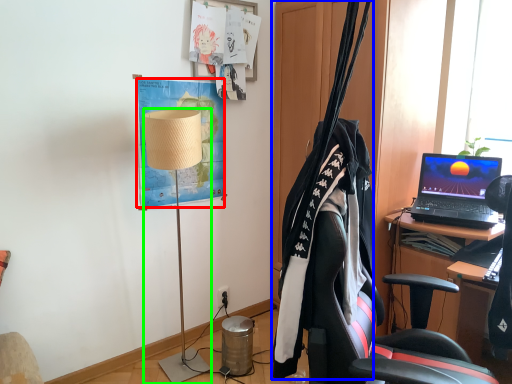
Question: Considering the real-world distances, which object is farthest from poster (highlighted by a red box)? clothesline (highlighted by a blue box) or lamp (highlighted by a green box)?

Choices:
 (A) clothesline
 (B) lamp

Answer: (A)